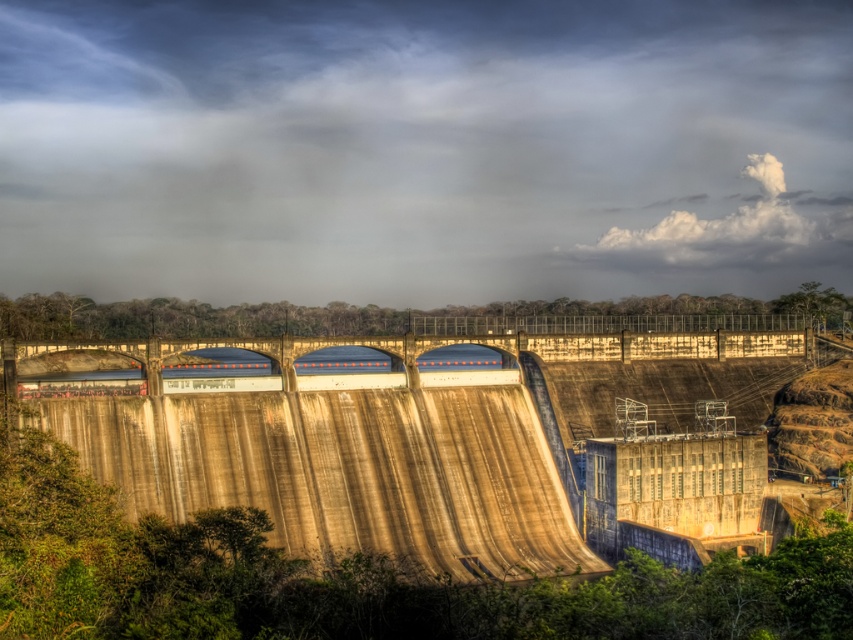
You are standing at the base of the concrete dam at center and want to know how far the cloudy sky at upper center is from your current position. Can you determine the distance?

The cloudy sky at upper center is 189.66 meters away from the concrete dam at center, so the distance from your current position at the base of the concrete dam at center to the cloudy sky at upper center is approximately 189.66 meters.

Looking at the image, which object is positioned higher up in the scene? The cloudy sky at upper center or the concrete dam at center?

The cloudy sky at upper center is positioned higher up in the scene than the concrete dam at center.

Looking at the image, which object occupies a wider area in the scene between the cloudy sky at upper center and the concrete dam at center?

The cloudy sky at upper center occupies a wider area than the concrete dam at center in the scene.